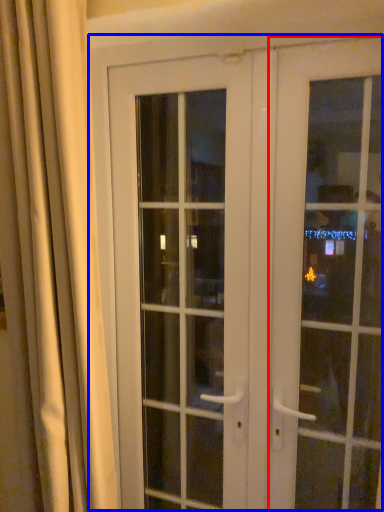
Question: Which object appears farthest to the camera in this image, door (highlighted by a red box) or door (highlighted by a blue box)?

Choices:
 (A) door
 (B) door

Answer: (B)